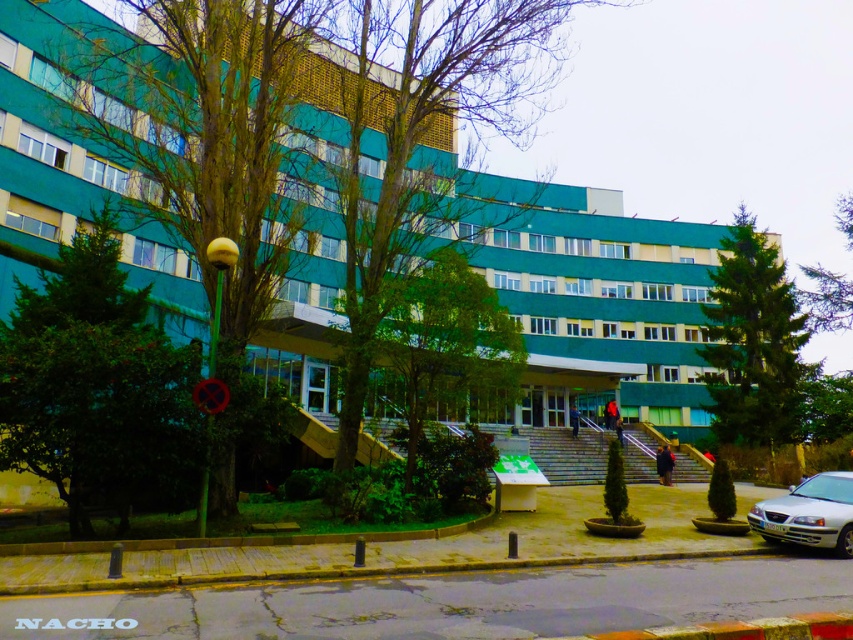
Is green glass building at center smaller than silver metallic car at lower right?

Actually, green glass building at center might be larger than silver metallic car at lower right.

Between green glass building at center and silver metallic car at lower right, which one has less height?

Standing shorter between the two is silver metallic car at lower right.

Is point (189, 262) farther from viewer compared to point (809, 497)?

Yes, it is.

This screenshot has width=853, height=640. Identify the location of green glass building at center. (596, 300).